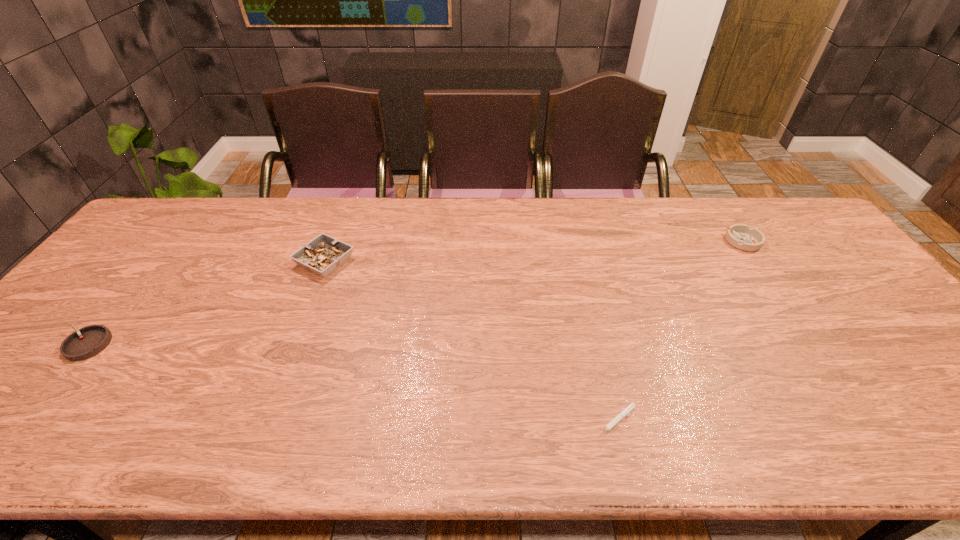
Identify the location of the tallest ashtray. (322, 255).

The width and height of the screenshot is (960, 540). I want to click on the tallest object, so click(x=322, y=255).

You are a GUI agent. You are given a task and a screenshot of the screen. Output one action in this format:
    pyautogui.click(x=<x>, y=<y>)
    Task: Click on the rightmost ashtray
    
    Given the screenshot: What is the action you would take?
    pyautogui.click(x=741, y=236)

Locate an element on the screen. The image size is (960, 540). the third farthest object is located at coordinates coord(89,341).

This screenshot has width=960, height=540. What are the coordinates of `the leftmost ashtray` in the screenshot? It's located at (89, 341).

I want to click on the shortest object, so click(624, 412).

I want to click on the second object from right to left, so click(x=624, y=412).

Where is `vacant region located 0.310m on the left of the tallest object`? The image size is (960, 540). vacant region located 0.310m on the left of the tallest object is located at coordinates (191, 261).

At what (x,y) coordinates should I click in order to perform the action: click on vacant space located 0.380m on the left of the rightmost ashtray. Please return your answer as a coordinate pair (x, y). The width and height of the screenshot is (960, 540). Looking at the image, I should click on click(604, 241).

The image size is (960, 540). What are the coordinates of `free spot located on the back of the leftmost ashtray` in the screenshot? It's located at (145, 272).